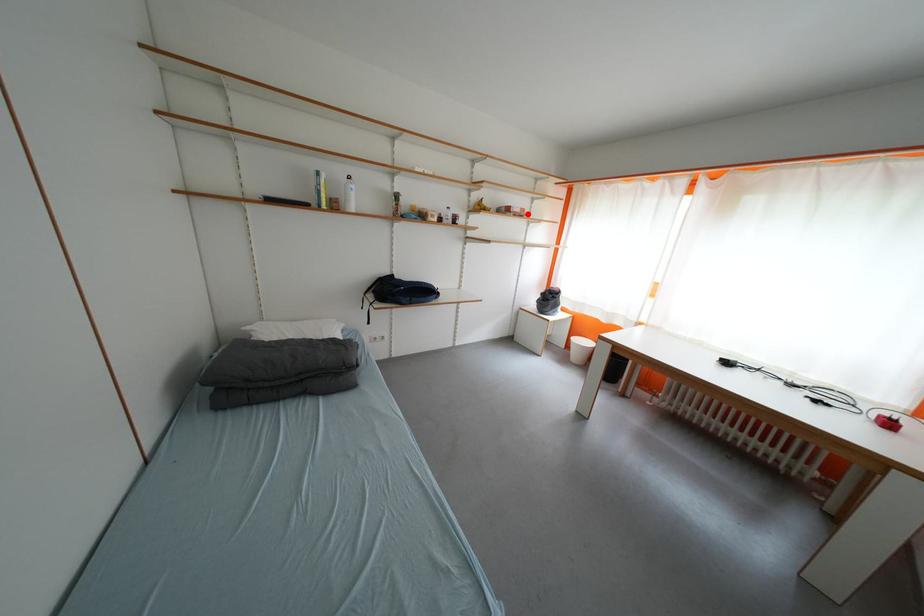
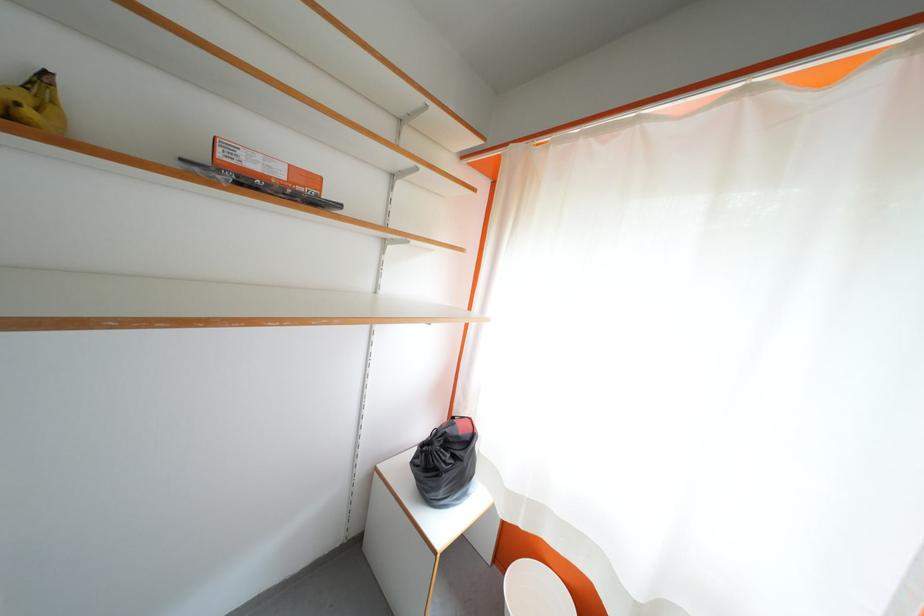
In the second image, find the point that corresponds to the highlighted location in the first image.

(289, 177)